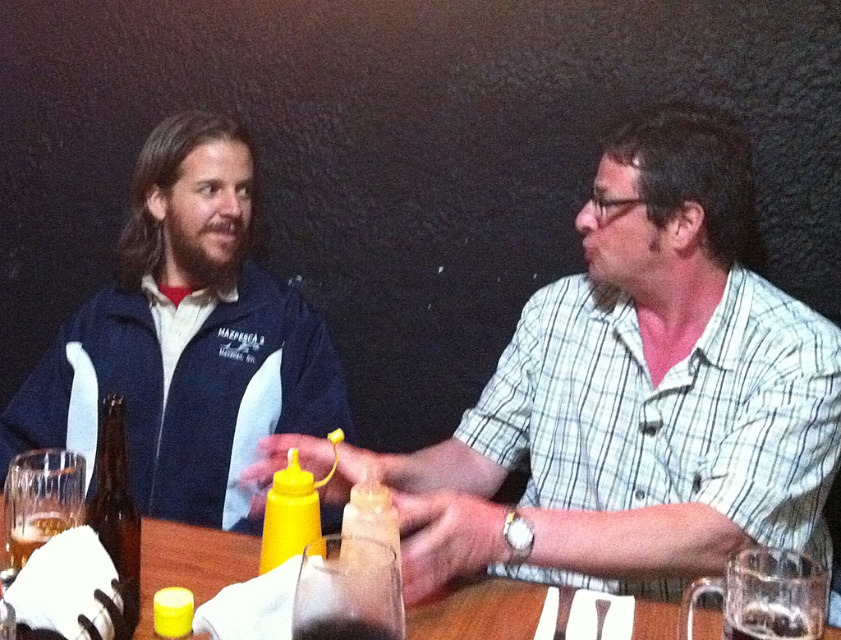
Question: Which point is closer to the camera taking this photo?

Choices:
 (A) (461, 612)
 (B) (159, 600)

Answer: (B)

Question: Which object is farther from the camera taking this photo?

Choices:
 (A) brown glass bottle at lower left
 (B) blue fleece jacket at left
 (C) wooden table at center
 (D) matte yellow mustard bottle at center

Answer: (B)

Question: Does brown glass bottle at lower left lie in front of yellow matte mustard at center?

Choices:
 (A) no
 (B) yes

Answer: (B)

Question: In this image, where is matte yellow mustard bottle at center located relative to yellow matte bottle at center?

Choices:
 (A) below
 (B) above

Answer: (B)

Question: Which is farther from the translucent glass at table center?

Choices:
 (A) matte yellow mustard bottle at center
 (B) wooden table at center
 (C) translucent plastic mustard at center

Answer: (B)

Question: Does brown glass bottle at lower left have a greater width compared to yellow matte bottle at center?

Choices:
 (A) yes
 (B) no

Answer: (A)